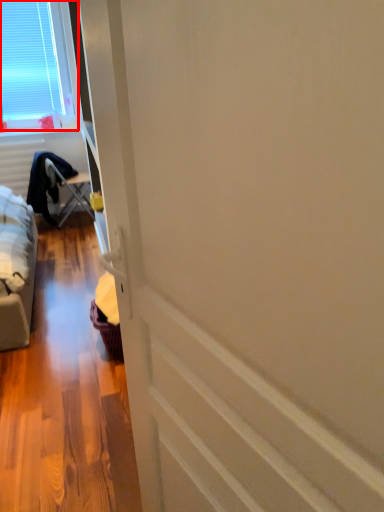
Question: Where is window (annotated by the red box) located in relation to furniture in the image?

Choices:
 (A) right
 (B) left

Answer: (B)